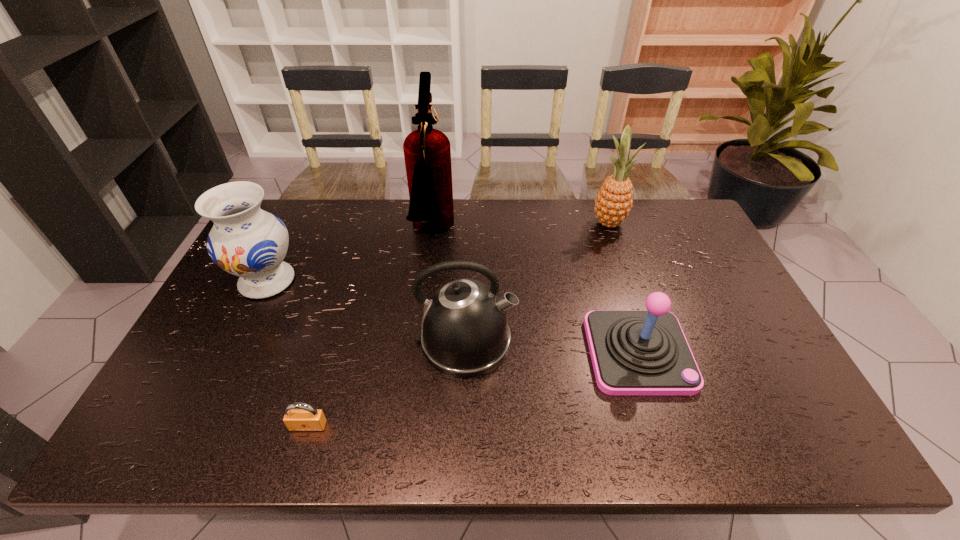
Where is `blank space at the far left corner`? The image size is (960, 540). blank space at the far left corner is located at coordinates (299, 219).

Locate an element on the screen. vacant space at the near left corner of the desktop is located at coordinates (191, 424).

This screenshot has width=960, height=540. Identify the location of vacant space that's between the pineapple and the kettle. (537, 281).

The width and height of the screenshot is (960, 540). I want to click on empty location between the kettle and the fifth tallest object, so click(552, 347).

Where is `empty space between the leftmost object and the tallest object`? The height and width of the screenshot is (540, 960). empty space between the leftmost object and the tallest object is located at coordinates (349, 256).

Image resolution: width=960 pixels, height=540 pixels. I want to click on unoccupied area between the shortest object and the leftmost object, so click(x=288, y=353).

Where is `free spot between the tallest object and the pineapple`? free spot between the tallest object and the pineapple is located at coordinates (520, 227).

You are a GUI agent. You are given a task and a screenshot of the screen. Output one action in this format:
    pyautogui.click(x=<x>, y=<y>)
    Task: Click on the vacant point located between the tallest object and the padlock
    Image resolution: width=960 pixels, height=540 pixels.
    Given the screenshot: What is the action you would take?
    pyautogui.click(x=371, y=329)

Where is `free space that is in between the vase and the fire extinguisher`? This screenshot has height=540, width=960. free space that is in between the vase and the fire extinguisher is located at coordinates (349, 256).

Where is `vacant region between the pineapple and the kettle`? vacant region between the pineapple and the kettle is located at coordinates (537, 281).